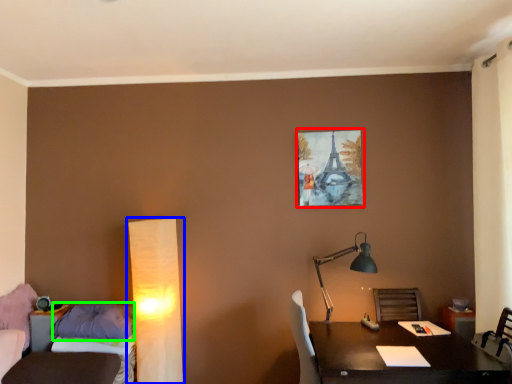
Question: Considering the real-world distances, which object is closest to picture frame (highlighted by a red box)? lamp (highlighted by a blue box) or pillow (highlighted by a green box).

Choices:
 (A) lamp
 (B) pillow

Answer: (A)